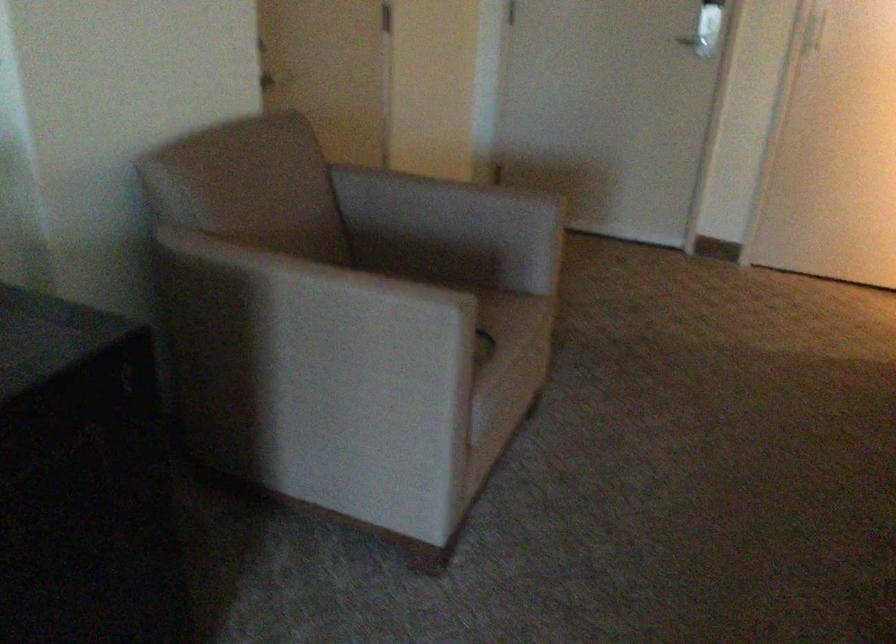
The height and width of the screenshot is (644, 896). What do you see at coordinates (314, 325) in the screenshot?
I see `a chair armrest` at bounding box center [314, 325].